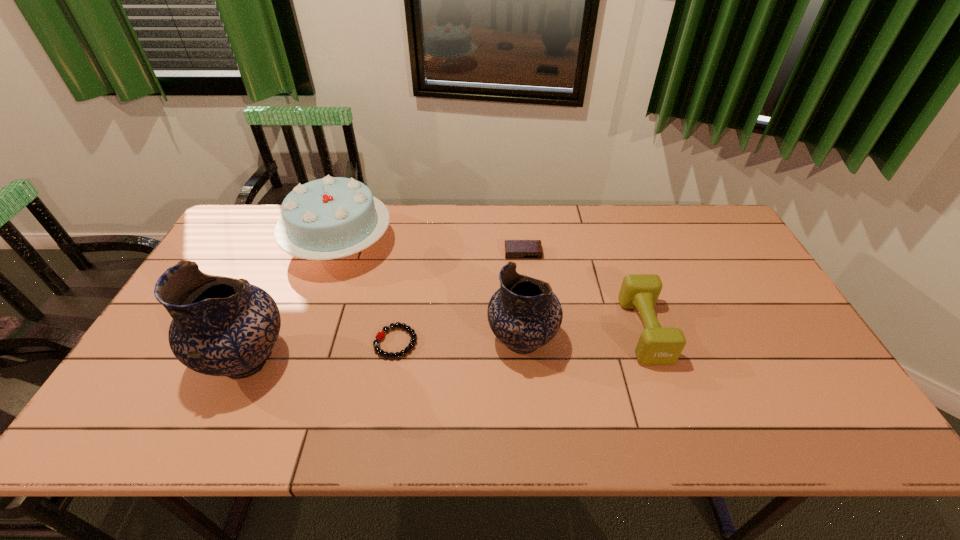
Find the location of `empty space that is in between the birthday cake and the third object from left to right`. empty space that is in between the birthday cake and the third object from left to right is located at coordinates (368, 294).

The height and width of the screenshot is (540, 960). Identify the location of vacant space that is in between the taller pottery and the shorter pottery. (384, 350).

At what (x,y) coordinates should I click in order to perform the action: click on the fourth closest object relative to the fourth tallest object. Please return your answer as a coordinate pair (x, y). Looking at the image, I should click on (333, 217).

Where is `the fourth closest object to the tallest object`? This screenshot has height=540, width=960. the fourth closest object to the tallest object is located at coordinates (514, 249).

This screenshot has height=540, width=960. In order to click on vacant area in the image that satisfies the following two spatial constraints: 1. on the front face of the third shortest object; 2. on the right side of the alarm clock in this screenshot , I will do `click(531, 330)`.

This screenshot has height=540, width=960. Find the location of `vacant space that satisfies the following two spatial constraints: 1. on the front face of the fourth tallest object; 2. on the right side of the fifth tallest object`. vacant space that satisfies the following two spatial constraints: 1. on the front face of the fourth tallest object; 2. on the right side of the fifth tallest object is located at coordinates (531, 330).

You are a GUI agent. You are given a task and a screenshot of the screen. Output one action in this format:
    pyautogui.click(x=<x>, y=<y>)
    Task: Click on the free spot that satisfies the following two spatial constraints: 1. on the front side of the shorter pottery; 2. on the left side of the birthday cake
    The width and height of the screenshot is (960, 540).
    Given the screenshot: What is the action you would take?
    pyautogui.click(x=305, y=340)

The height and width of the screenshot is (540, 960). What are the coordinates of `free space that satisfies the following two spatial constraints: 1. on the back side of the right pottery; 2. on the right side of the bracelet` in the screenshot? It's located at pyautogui.click(x=396, y=340).